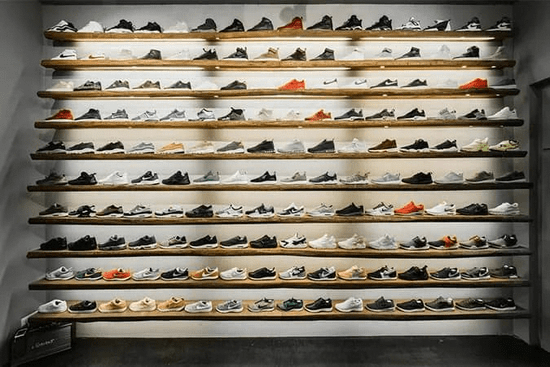
In order to click on shelves below shoes in this screenshot , I will do `click(258, 35)`, `click(265, 65)`, `click(268, 92)`, `click(270, 120)`, `click(271, 153)`, `click(275, 186)`, `click(274, 221)`, `click(274, 249)`, `click(273, 283)`, `click(272, 315)`.